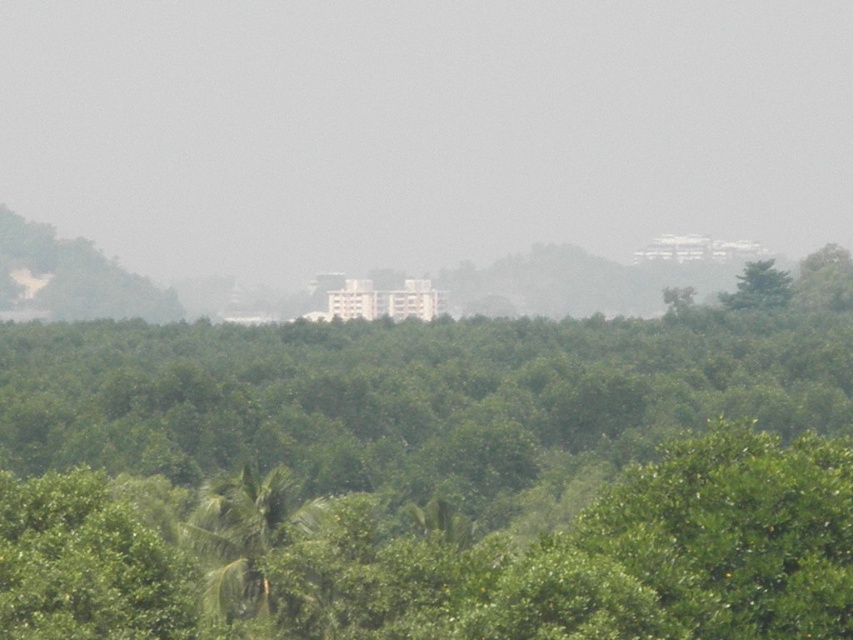
Question: Which object is closer to the camera taking this photo?

Choices:
 (A) green leafy forest at center
 (B) green leafy tree at upper right

Answer: (A)

Question: In this image, where is green leafy forest at center located relative to green leafy tree at upper right?

Choices:
 (A) left
 (B) right

Answer: (A)

Question: Which of the following is the closest to the observer?

Choices:
 (A) green leafy tree at upper right
 (B) green leafy forest at center

Answer: (B)

Question: Can you confirm if green leafy forest at center is smaller than green leafy tree at upper right?

Choices:
 (A) no
 (B) yes

Answer: (A)

Question: Which point appears farthest from the camera in this image?

Choices:
 (A) (523, 628)
 (B) (746, 307)

Answer: (B)

Question: Does green leafy forest at center have a greater width compared to green leafy tree at upper right?

Choices:
 (A) no
 (B) yes

Answer: (B)